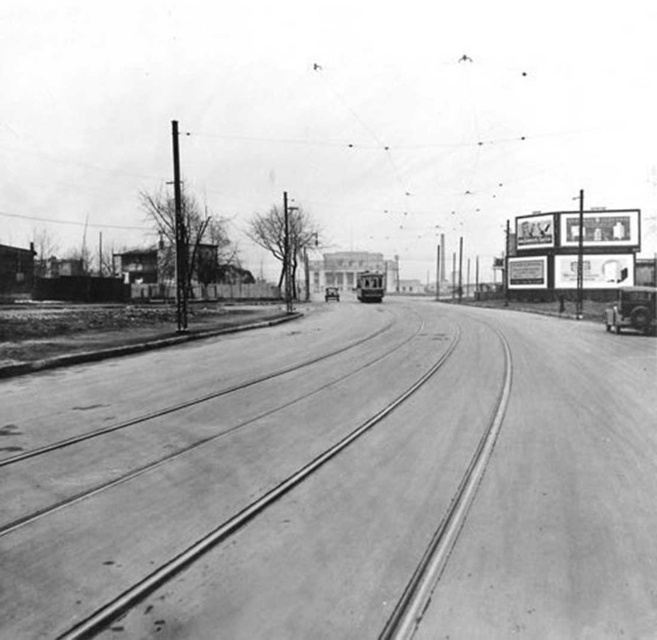
You are a city planner analyzing this historical street layout. The image shows a smooth asphalt train track at center and a shiny silver car at right. Which of these two objects occupies a larger width in the image?

The shiny silver car at right is wider than the smooth asphalt train track at center, so it occupies a larger width in the image.

You are a city planner reviewing this historical street layout. The polished brass tram at center is currently positioned over the smooth asphalt train track at center. Is there a risk of the tram derailing if it continues moving forward along the track?

The smooth asphalt train track at center is below the polished brass tram at center, which means the tram is directly on the track. Since the tram is designed to run on the tracks, there is no risk of derailing as long as the track is intact and the tram is properly maintained.

You are a pedestrian standing on the left side of the road and want to cross to the right side. You see the smooth asphalt train track at center and the polished brass tram at center. Which object should you avoid stepping on to stay safe?

You should avoid stepping on the smooth asphalt train track at center because it is positioned on the right side of the polished brass tram at center, meaning it is closer to the tram and part of the track where the tram operates. Stepping on the tracks could be dangerous.